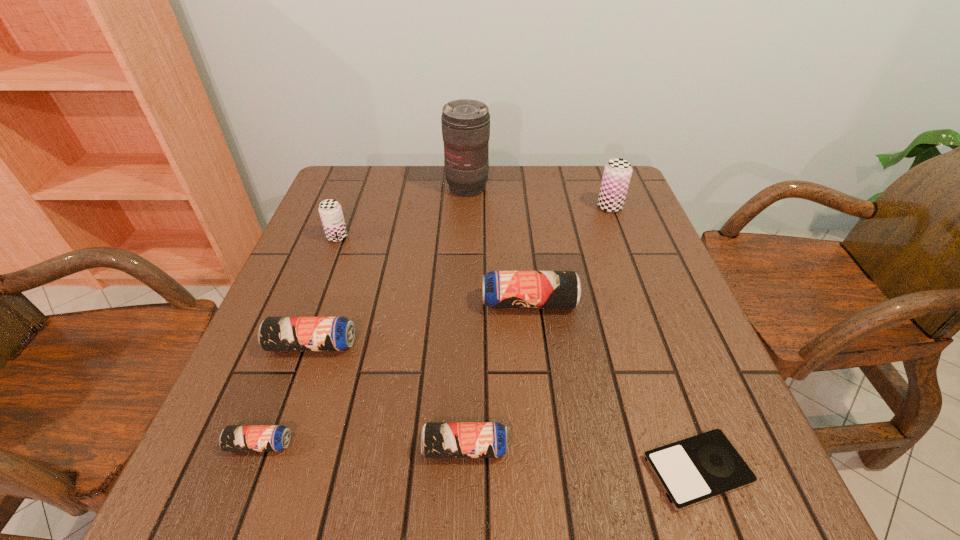
Find the location of a particular element. object that is at the near right corner is located at coordinates (699, 468).

Where is `free space at the far edge of the desktop`? This screenshot has height=540, width=960. free space at the far edge of the desktop is located at coordinates (429, 204).

Locate an element on the screen. This screenshot has height=540, width=960. vacant area at the near edge is located at coordinates (417, 511).

The height and width of the screenshot is (540, 960). I want to click on vacant space at the left edge, so click(x=243, y=376).

This screenshot has width=960, height=540. In the image, there is a desktop. Find the location of `vacant space at the right edge`. vacant space at the right edge is located at coordinates (641, 265).

You are a GUI agent. You are given a task and a screenshot of the screen. Output one action in this format:
    pyautogui.click(x=<x>, y=<y>)
    Task: Click on the vacant position at the far left corner of the desktop
    The height and width of the screenshot is (540, 960).
    Given the screenshot: What is the action you would take?
    pyautogui.click(x=364, y=180)

At what (x,y) coordinates should I click in order to perform the action: click on vacant space at the near left corner of the desktop. Please return your answer as a coordinate pair (x, y). The width and height of the screenshot is (960, 540). Looking at the image, I should click on (220, 503).

Locate an element on the screen. This screenshot has height=540, width=960. free space at the far right corner is located at coordinates (589, 204).

At what (x,y) coordinates should I click in order to perform the action: click on free space between the third nearest blue beer can and the left purple beer can. Please return your answer as a coordinate pair (x, y). Image resolution: width=960 pixels, height=540 pixels. Looking at the image, I should click on (324, 291).

This screenshot has width=960, height=540. I want to click on vacant area that lies between the rightmost beer can and the gray iPod, so click(x=654, y=339).